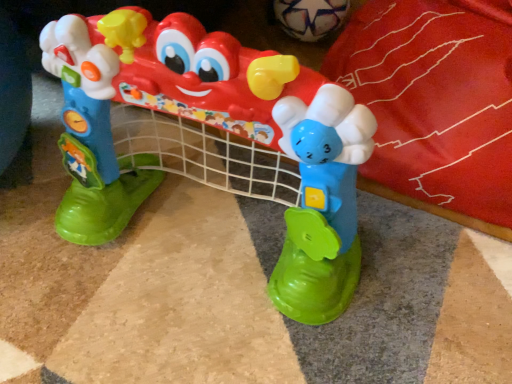
Image resolution: width=512 pixels, height=384 pixels. Describe the element at coordinates (310, 17) in the screenshot. I see `white matte soccer ball at upper center, the first toy positioned from the back` at that location.

You are a GUI agent. You are given a task and a screenshot of the screen. Output one action in this format:
    pyautogui.click(x=<x>, y=<y>)
    Task: Click on the white matte soccer ball at upper center, the 2th toy in the front-to-back sequence
    This screenshot has width=512, height=384.
    Given the screenshot: What is the action you would take?
    pyautogui.click(x=310, y=17)

Measure the distance between point (305,28) and camera.

Point (305,28) is 3.77 feet away from camera.

Locate an element on the screen. The height and width of the screenshot is (384, 512). plastic toy at center, which is the first toy in bottom-to-top order is located at coordinates (240, 128).

Describe the element at coordinates (240, 128) in the screenshot. The width and height of the screenshot is (512, 384). I see `plastic toy at center, the first toy in the front-to-back sequence` at that location.

Find the location of `white matte soccer ball at upper center, the 2th toy in the front-to-back sequence`. white matte soccer ball at upper center, the 2th toy in the front-to-back sequence is located at coordinates (310, 17).

Considering the relative positions of plastic toy at center, which is the 2th toy in back-to-front order, and white matte soccer ball at upper center, the first toy in the top-to-bottom sequence, in the image provided, is plastic toy at center, which is the 2th toy in back-to-front order, to the left of white matte soccer ball at upper center, the first toy in the top-to-bottom sequence, from the viewer's perspective?

Yes.

Considering the relative positions of plastic toy at center, the first toy in the front-to-back sequence, and white matte soccer ball at upper center, the first toy in the top-to-bottom sequence, in the image provided, is plastic toy at center, the first toy in the front-to-back sequence, in front of white matte soccer ball at upper center, the first toy in the top-to-bottom sequence,?

That is True.

Does point (221, 95) lie in front of point (294, 27)?

That is True.

From the image's perspective, which is above, plastic toy at center, the first toy in the front-to-back sequence, or white matte soccer ball at upper center, the 2th toy positioned from the bottom?

From the image's view, white matte soccer ball at upper center, the 2th toy positioned from the bottom, is above.

From a real-world perspective, is plastic toy at center, which is the 2th toy in back-to-front order, over white matte soccer ball at upper center, the first toy in the top-to-bottom sequence?

Yes, from a real-world perspective, plastic toy at center, which is the 2th toy in back-to-front order, is above white matte soccer ball at upper center, the first toy in the top-to-bottom sequence.

Can you confirm if plastic toy at center, the first toy in the front-to-back sequence, is wider than white matte soccer ball at upper center, the 2th toy positioned from the bottom?

Indeed, plastic toy at center, the first toy in the front-to-back sequence, has a greater width compared to white matte soccer ball at upper center, the 2th toy positioned from the bottom.

Considering the sizes of objects plastic toy at center, the first toy in the front-to-back sequence, and white matte soccer ball at upper center, the first toy positioned from the back, in the image provided, who is shorter, plastic toy at center, the first toy in the front-to-back sequence, or white matte soccer ball at upper center, the first toy positioned from the back,?

Standing shorter between the two is white matte soccer ball at upper center, the first toy positioned from the back.

Who is smaller, plastic toy at center, which is the first toy in bottom-to-top order, or white matte soccer ball at upper center, the 2th toy in the front-to-back sequence?

Smaller between the two is white matte soccer ball at upper center, the 2th toy in the front-to-back sequence.

Does plastic toy at center, the first toy in the front-to-back sequence, contain white matte soccer ball at upper center, the first toy positioned from the back?

No.

Can you see plastic toy at center, the first toy in the front-to-back sequence, touching white matte soccer ball at upper center, the first toy in the top-to-bottom sequence?

There is a gap between plastic toy at center, the first toy in the front-to-back sequence, and white matte soccer ball at upper center, the first toy in the top-to-bottom sequence.

Consider the image. Is plastic toy at center, which ranks as the second toy in top-to-bottom order, oriented towards white matte soccer ball at upper center, the 2th toy positioned from the bottom?

No, plastic toy at center, which ranks as the second toy in top-to-bottom order, is not turned towards white matte soccer ball at upper center, the 2th toy positioned from the bottom.

Identify the location of toy above the plastic toy at center, which is the first toy in bottom-to-top order (from the image's perspective). This screenshot has height=384, width=512. (310, 17).

Between white matte soccer ball at upper center, the first toy in the top-to-bottom sequence, and plastic toy at center, which is the 2th toy in back-to-front order, which one appears on the left side from the viewer's perspective?

From the viewer's perspective, plastic toy at center, which is the 2th toy in back-to-front order, appears more on the left side.

Is the position of white matte soccer ball at upper center, the first toy in the top-to-bottom sequence, more distant than that of plastic toy at center, the first toy in the front-to-back sequence?

Yes, white matte soccer ball at upper center, the first toy in the top-to-bottom sequence, is further from the viewer.

Which is more distant, (292, 26) or (353, 118)?

The point (292, 26) is farther from the camera.

From the image's perspective, is white matte soccer ball at upper center, the first toy positioned from the back, below plastic toy at center, which is the 2th toy in back-to-front order?

No.

From a real-world perspective, is white matte soccer ball at upper center, the first toy in the top-to-bottom sequence, physically above plastic toy at center, which is the 2th toy in back-to-front order?

No, from a real-world perspective, white matte soccer ball at upper center, the first toy in the top-to-bottom sequence, is not above plastic toy at center, which is the 2th toy in back-to-front order.

Considering the sizes of objects white matte soccer ball at upper center, the first toy positioned from the back, and plastic toy at center, which is the 2th toy in back-to-front order, in the image provided, who is thinner, white matte soccer ball at upper center, the first toy positioned from the back, or plastic toy at center, which is the 2th toy in back-to-front order,?

With smaller width is white matte soccer ball at upper center, the first toy positioned from the back.

Considering the sizes of objects white matte soccer ball at upper center, the first toy positioned from the back, and plastic toy at center, which is the first toy in bottom-to-top order, in the image provided, who is shorter, white matte soccer ball at upper center, the first toy positioned from the back, or plastic toy at center, which is the first toy in bottom-to-top order,?

white matte soccer ball at upper center, the first toy positioned from the back.

Which of these two, white matte soccer ball at upper center, the first toy positioned from the back, or plastic toy at center, the first toy in the front-to-back sequence, is bigger?

With larger size is plastic toy at center, the first toy in the front-to-back sequence.

Is white matte soccer ball at upper center, the 2th toy in the front-to-back sequence, surrounding plastic toy at center, the first toy in the front-to-back sequence?

Actually, plastic toy at center, the first toy in the front-to-back sequence, is outside white matte soccer ball at upper center, the 2th toy in the front-to-back sequence.

Can you see white matte soccer ball at upper center, the 2th toy in the front-to-back sequence, touching plastic toy at center, which is the first toy in bottom-to-top order?

No, white matte soccer ball at upper center, the 2th toy in the front-to-back sequence, is not next to plastic toy at center, which is the first toy in bottom-to-top order.

Is white matte soccer ball at upper center, the 2th toy in the front-to-back sequence, oriented away from plastic toy at center, which ranks as the second toy in top-to-bottom order?

No, white matte soccer ball at upper center, the 2th toy in the front-to-back sequence,'s orientation is not away from plastic toy at center, which ranks as the second toy in top-to-bottom order.

How different are the orientations of white matte soccer ball at upper center, the 2th toy in the front-to-back sequence, and plastic toy at center, which ranks as the second toy in top-to-bottom order, in degrees?

6.52 degrees separate the facing orientations of white matte soccer ball at upper center, the 2th toy in the front-to-back sequence, and plastic toy at center, which ranks as the second toy in top-to-bottom order.

Image resolution: width=512 pixels, height=384 pixels. I want to click on toy located above the plastic toy at center, which is the first toy in bottom-to-top order (from the image's perspective), so click(x=310, y=17).

What are the coordinates of `toy below the plastic toy at center, which is the first toy in bottom-to-top order (from a real-world perspective)` in the screenshot? It's located at (310, 17).

I want to click on toy behind the plastic toy at center, the first toy in the front-to-back sequence, so click(310, 17).